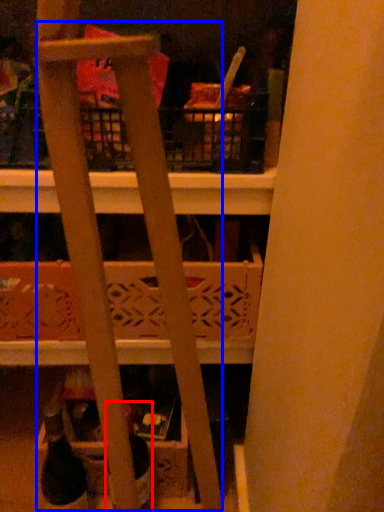
Question: Which of the following is the farthest to the observer, bottle (highlighted by a red box) or ladder (highlighted by a blue box)?

Choices:
 (A) bottle
 (B) ladder

Answer: (A)